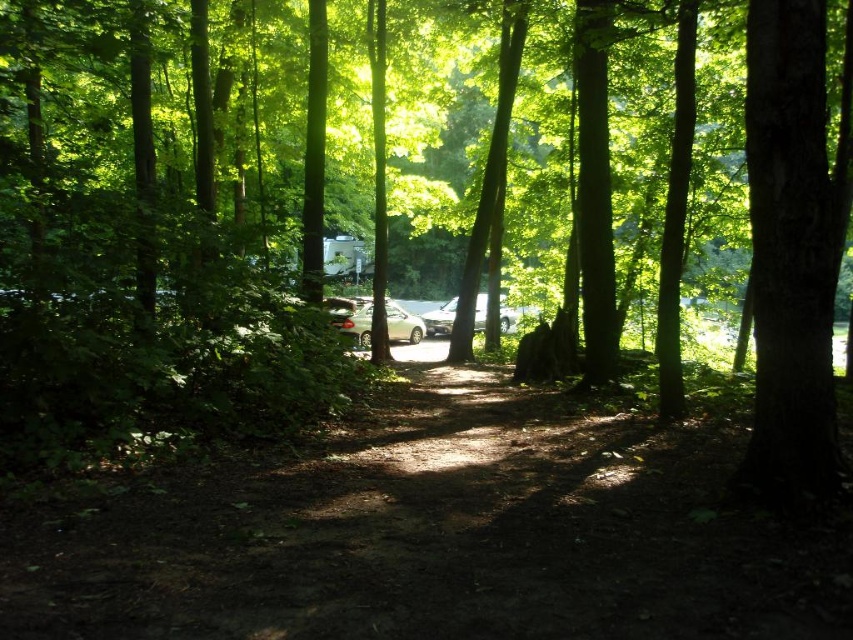
Question: Is smooth bark tree at right positioned before metallic silver car at center?

Choices:
 (A) no
 (B) yes

Answer: (B)

Question: Can you confirm if dirt path at center is smaller than metallic silver car at center?

Choices:
 (A) yes
 (B) no

Answer: (B)

Question: Which object appears farthest from the camera in this image?

Choices:
 (A) silver metallic car at center
 (B) dirt path at center

Answer: (A)

Question: Among these points, which one is nearest to the camera?

Choices:
 (A) (790, 221)
 (B) (576, 404)

Answer: (A)

Question: Does silver metallic car at center lie behind metallic silver car at center?

Choices:
 (A) no
 (B) yes

Answer: (A)

Question: Which of the following is the closest to the observer?

Choices:
 (A) pyautogui.click(x=363, y=308)
 (B) pyautogui.click(x=744, y=145)
 (C) pyautogui.click(x=442, y=332)

Answer: (B)